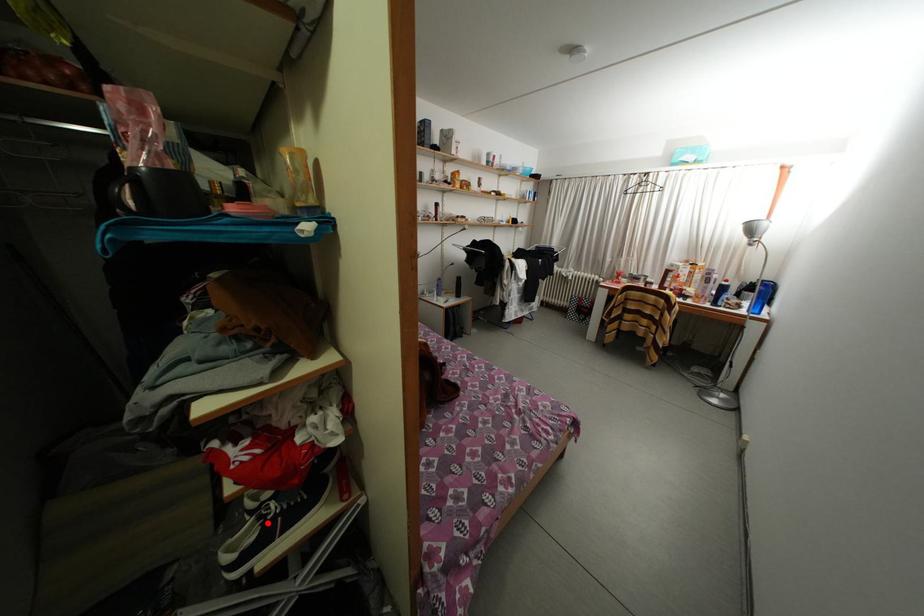
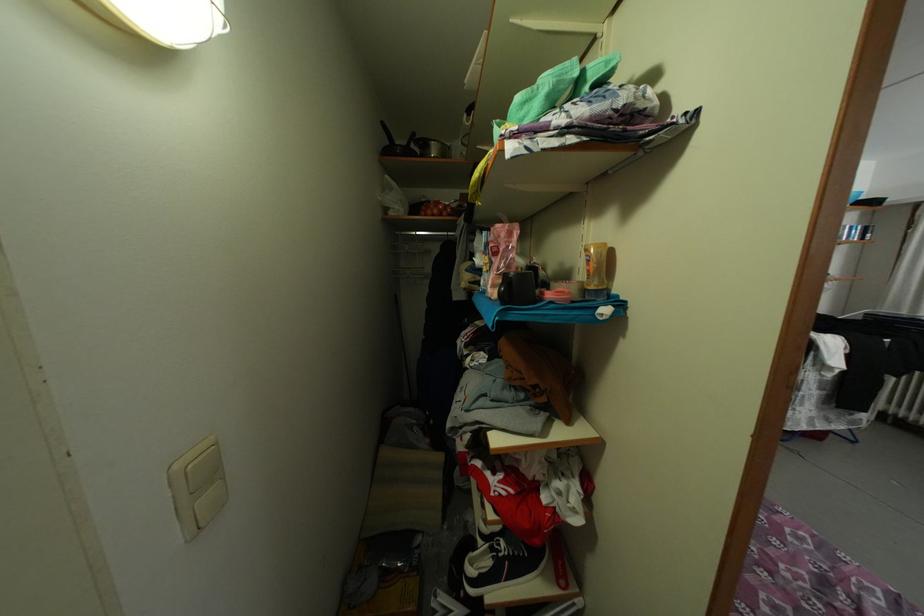
Question: I am providing you with two images of the same scene from different viewpoints. In image1, a red point is highlighted. Considering the same 3D point in image2, which of the following is correct?

Choices:
 (A) It is closer
 (B) It is farther

Answer: (B)